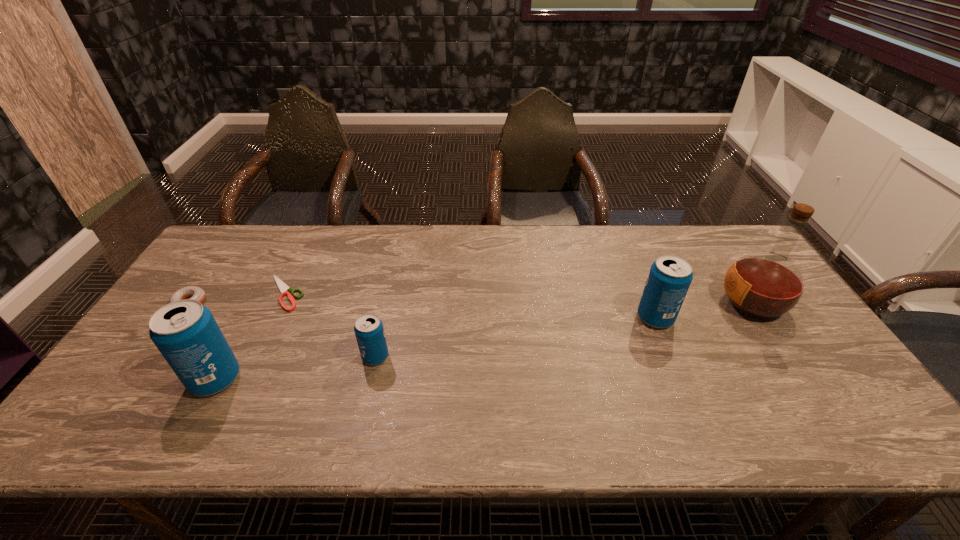
I want to click on object present at the right edge, so click(x=764, y=285).

Find the location of `free space at the far edge`. free space at the far edge is located at coordinates (255, 266).

This screenshot has height=540, width=960. In the image, there is a desktop. What are the coordinates of `free space at the near edge` in the screenshot? It's located at (774, 393).

Find the location of a particular element. The height and width of the screenshot is (540, 960). free space at the left edge of the desktop is located at coordinates [224, 274].

This screenshot has height=540, width=960. What are the coordinates of `vacant space at the far left corner of the desktop` in the screenshot? It's located at (217, 246).

In the image, there is a desktop. Where is `free region at the far right corner`? This screenshot has width=960, height=540. free region at the far right corner is located at coordinates (743, 245).

The height and width of the screenshot is (540, 960). What are the coordinates of `blank space at the near right corner of the desktop` in the screenshot? It's located at (810, 393).

This screenshot has height=540, width=960. Find the location of `blank region between the leftmost soda can and the liquor`. blank region between the leftmost soda can and the liquor is located at coordinates (484, 341).

This screenshot has height=540, width=960. Find the location of `vacant area between the second shortest object and the shortest soda can`. vacant area between the second shortest object and the shortest soda can is located at coordinates 282,329.

The width and height of the screenshot is (960, 540). In order to click on empty location between the fifth object from left to right and the liquor in this screenshot , I will do `click(704, 310)`.